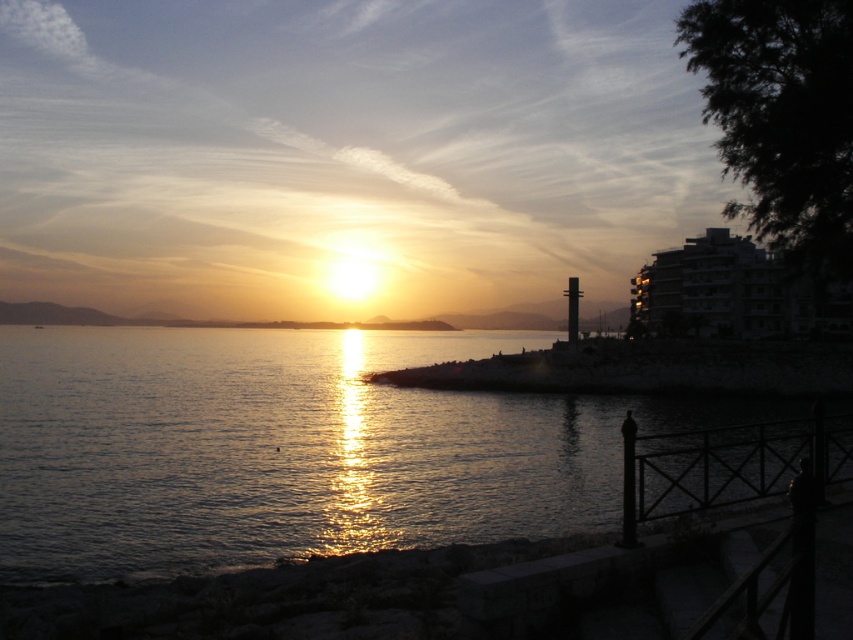
Question: Which point is farther to the camera?

Choices:
 (A) click(83, 417)
 (B) click(585, 369)

Answer: (B)

Question: Can you confirm if glistening water at center is positioned below dark stone shoreline at lower center?

Choices:
 (A) yes
 (B) no

Answer: (A)

Question: Which of the following is the closest to the observer?

Choices:
 (A) glistening water at center
 (B) dark stone shoreline at lower center

Answer: (A)

Question: Can you confirm if glistening water at center is positioned to the left of dark stone shoreline at lower center?

Choices:
 (A) yes
 (B) no

Answer: (A)

Question: Can you confirm if glistening water at center is positioned below dark stone shoreline at lower center?

Choices:
 (A) yes
 (B) no

Answer: (A)